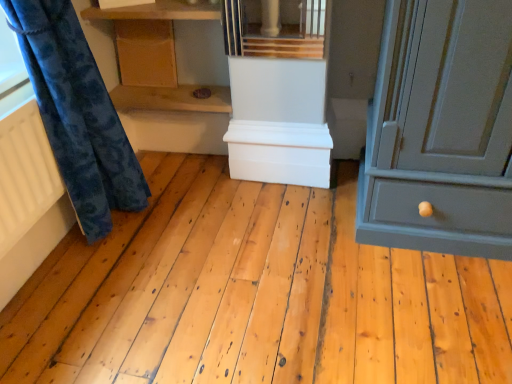
Question: From a real-world perspective, is white matte chest at center, arranged as the second cabinetry when viewed from the top, physically located above or below white matte radiator at left?

Choices:
 (A) below
 (B) above

Answer: (A)

Question: In terms of size, does white matte chest at center, arranged as the second cabinetry when viewed from the top, appear bigger or smaller than white matte radiator at left?

Choices:
 (A) big
 (B) small

Answer: (A)

Question: Estimate the real-world distances between objects in this image. Which object is closer to the wooden cabinet at upper center, which is the 2th cabinetry in bottom-to-top order?

Choices:
 (A) wooden shelf at upper center, acting as the first shelf starting from the top
 (B) white matte chest at center, which ranks as the first cabinetry in right-to-left order
 (C) matte gray cabinet at right
 (D) velvety blue curtain at left
 (E) white matte radiator at left

Answer: (A)

Question: Considering the real-world distances, which object is farthest from the matte gray cabinet at right?

Choices:
 (A) wooden shelf at center, the second shelf positioned from the top
 (B) velvety blue curtain at left
 (C) white matte chest at center, which ranks as the first cabinetry in right-to-left order
 (D) wooden cabinet at upper center, which is the 2th cabinetry in bottom-to-top order
 (E) white matte radiator at left

Answer: (E)